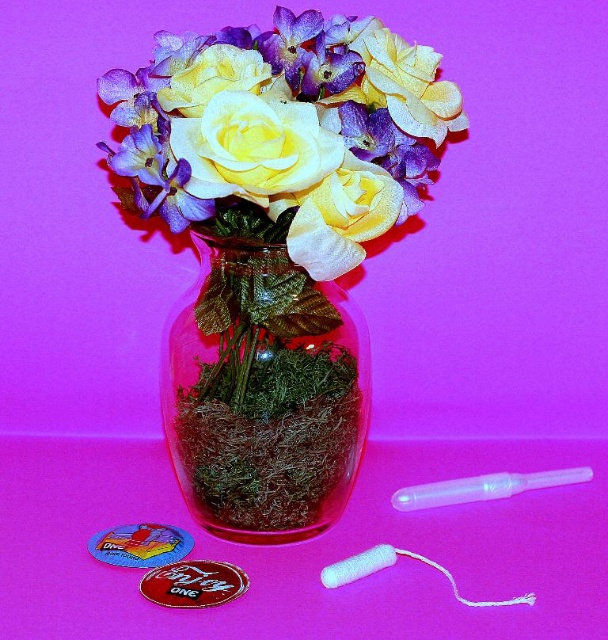
Question: Can you confirm if translucent glass vase at center is positioned to the right of matte yellow fabric rose at center?

Choices:
 (A) yes
 (B) no

Answer: (B)

Question: Which point appears closest to the camera in this image?

Choices:
 (A) (326, 170)
 (B) (174, 448)

Answer: (A)

Question: Which of the following is the farthest from the observer?

Choices:
 (A) (195, 209)
 (B) (187, 413)
 (C) (212, 124)
 (D) (382, 193)

Answer: (B)

Question: Can you confirm if matte yellow rose at center is positioned below matte yellow fabric rose at center?

Choices:
 (A) yes
 (B) no

Answer: (B)

Question: Is transparent glass vase at center positioned at the back of matte yellow rose at center?

Choices:
 (A) yes
 (B) no

Answer: (A)

Question: Which object is positioned farthest from the translucent glass vase at center?

Choices:
 (A) matte yellow fabric rose at center
 (B) matte yellow rose at center
 (C) transparent glass vase at center

Answer: (B)